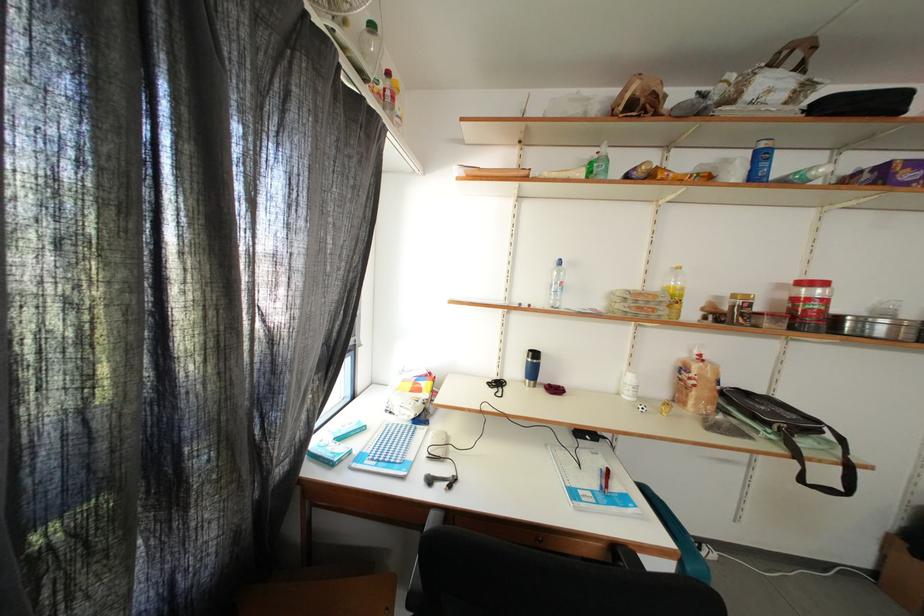
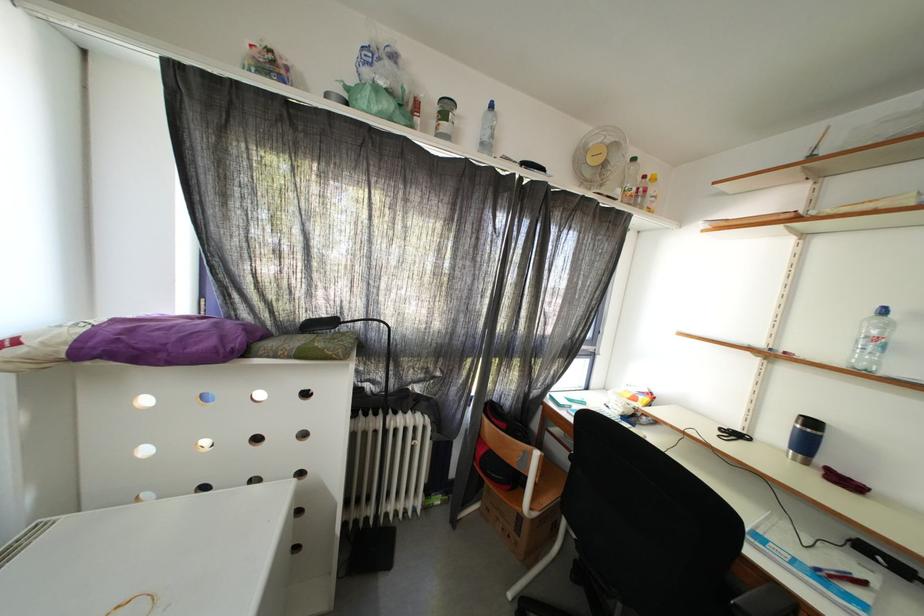
Find the pixel in the second image that matches point 623,492 in the first image.

(864, 597)